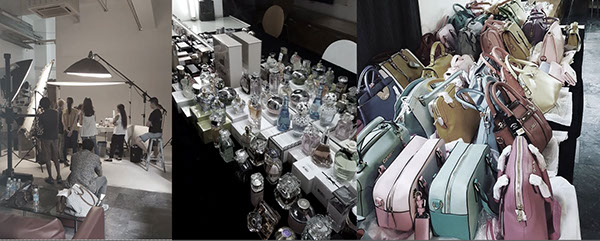
At what (x,y) coordinates should I click in order to perform the action: click on white square rug. Please return your answer as a coordinate pair (x, y). The height and width of the screenshot is (241, 600). Looking at the image, I should click on (119, 170).